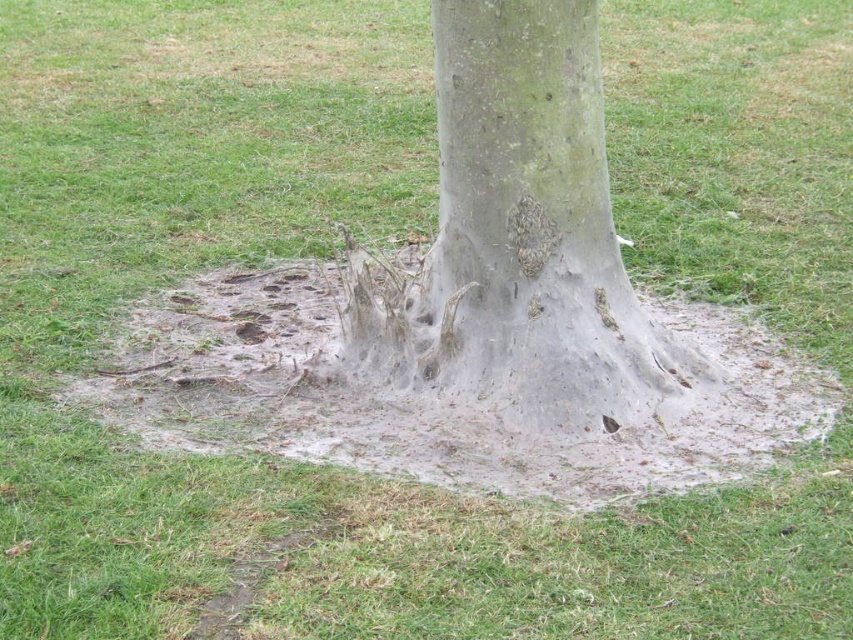
You are a gardener trying to determine the space needed for a new plant. You see the white sandy mud at center and the gray rough bark at center. Which one has a greater width?

The white sandy mud at center has a greater width than the gray rough bark at center according to the description.

You are a gardener trying to determine the position of the white sandy mud at center and the gray rough bark at center. Based on the scene, which object is located to the left of the other?

The white sandy mud at center is to the left of gray rough bark at center according to the description.